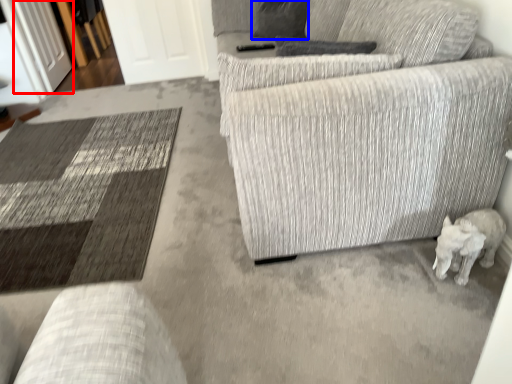
Question: Among these objects, which one is farthest to the camera, glass door (highlighted by a red box) or pillow (highlighted by a blue box)?

Choices:
 (A) glass door
 (B) pillow

Answer: (A)